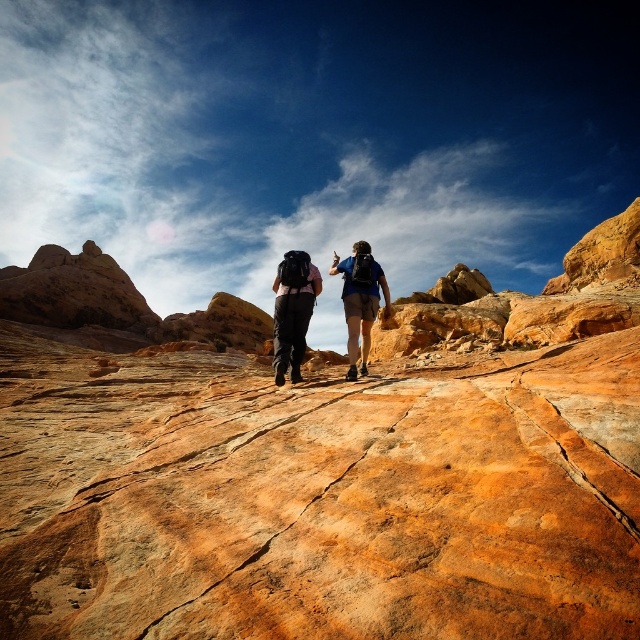
Question: Which is nearer to the matte black backpacks at center?

Choices:
 (A) matte blue backpack at center
 (B) matte black backpack at center

Answer: (A)

Question: Which is farther from the matte black backpack at center?

Choices:
 (A) matte blue backpack at center
 (B) matte black backpacks at center

Answer: (A)

Question: Can you confirm if matte black backpack at center is wider than matte blue backpack at center?

Choices:
 (A) no
 (B) yes

Answer: (A)

Question: Considering the relative positions of matte black backpacks at center and matte blue backpack at center in the image provided, where is matte black backpacks at center located with respect to matte blue backpack at center?

Choices:
 (A) right
 (B) left

Answer: (B)

Question: Which is farther from the matte black backpack at center?

Choices:
 (A) matte blue backpack at center
 (B) matte black backpacks at center

Answer: (A)

Question: Does matte black backpacks at center have a smaller size compared to matte blue backpack at center?

Choices:
 (A) no
 (B) yes

Answer: (B)